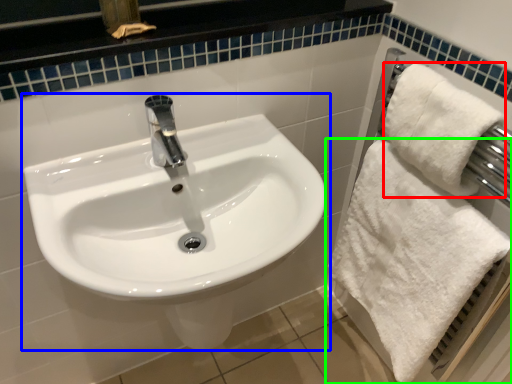
Question: Based on their relative distances, which object is farther from bath towel (highlighted by a red box)? Choose from sink (highlighted by a blue box) and towel (highlighted by a green box).

Choices:
 (A) sink
 (B) towel

Answer: (A)